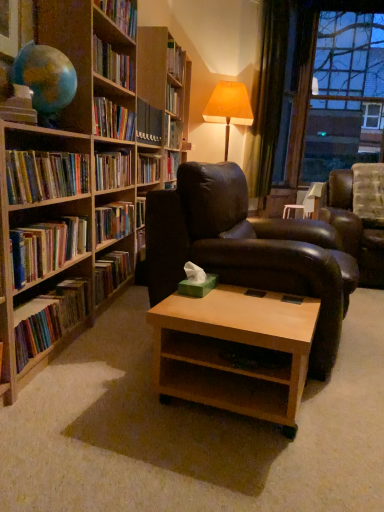
Where is `empty space that is ontop of light brown wood coffee table at center (from a real-world perspective)`? The width and height of the screenshot is (384, 512). empty space that is ontop of light brown wood coffee table at center (from a real-world perspective) is located at coordinates (243, 306).